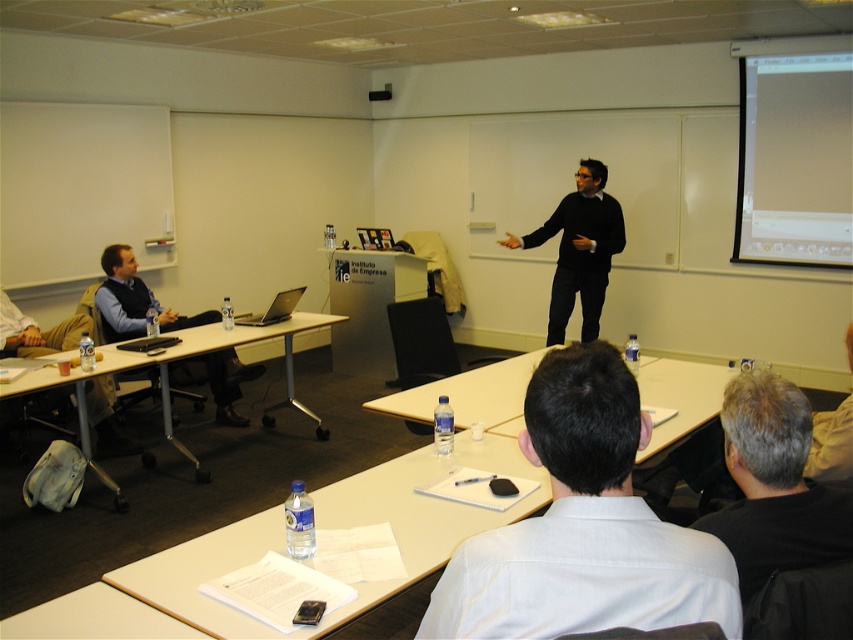
You are standing in the classroom and want to take a photo of the point at coordinates [123,493]. The camera you have can focus clearly on objects between 10 and 15 feet away. Will the point be in focus?

The point at coordinates [123,493] is 12.52 feet away from the camera, which falls within the focus range of 10 to 15 feet. Therefore, the point will be in focus.

You are a student trying to reach the silver metallic table at center from where you are sitting at the matte black vest at left. Can you walk directly to the table without moving around any obstacles?

The silver metallic table at center is further to the viewer than the matte black vest at left, so you are sitting behind the table. Therefore, you can walk directly to the table without needing to move around any obstacles since it is in front of you.